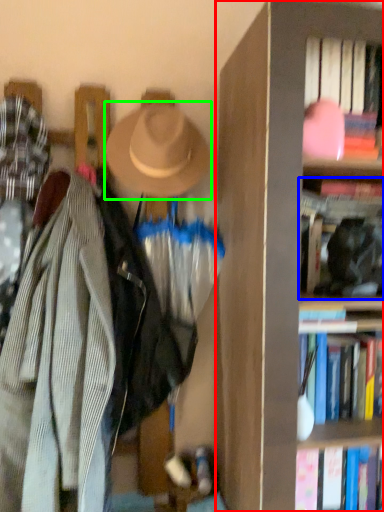
Question: Based on their relative distances, which object is nearer to bookcase (highlighted by a red box)? Choose from book (highlighted by a blue box) and hat (highlighted by a green box).

Choices:
 (A) book
 (B) hat

Answer: (A)